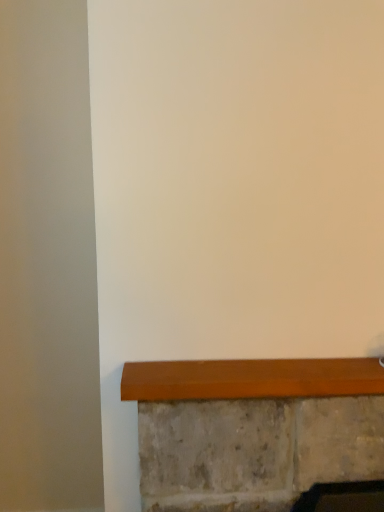
Question: Should I look upward or downward to see matte wood window sill at lower center?

Choices:
 (A) up
 (B) down

Answer: (B)